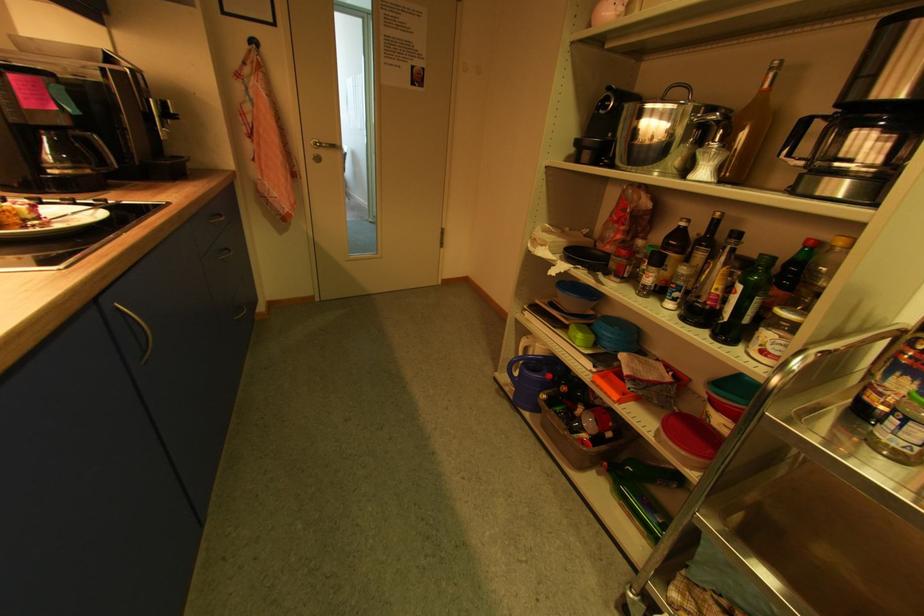
Where is `metal cart handle`? metal cart handle is located at coordinates (886, 378).